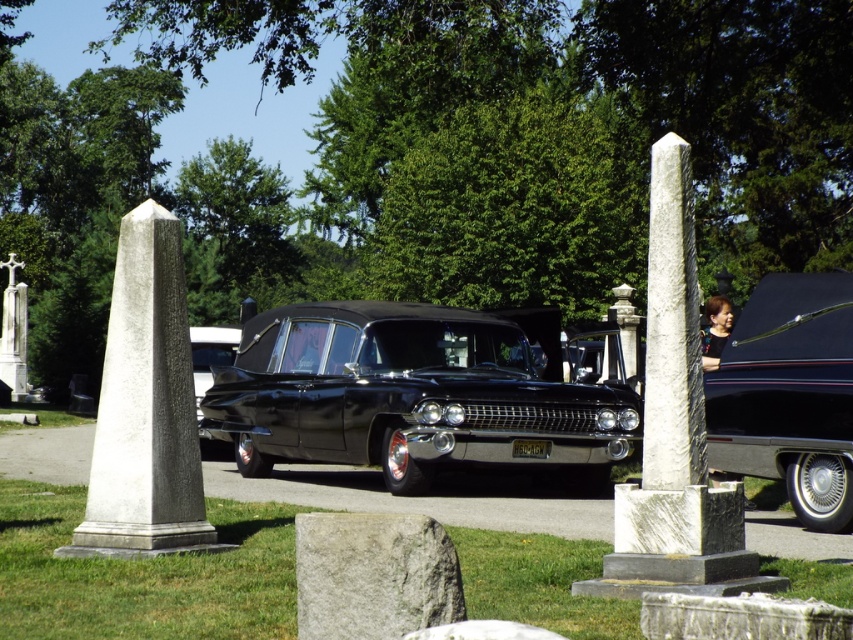
Question: Can you confirm if white marble obelisk at center is bigger than white marble cross at center?

Choices:
 (A) yes
 (B) no

Answer: (B)

Question: Which object is the farthest from the glossy black hearse at center?

Choices:
 (A) white marble cross at center
 (B) white marble obelisk at center

Answer: (A)

Question: Can you confirm if gray marble obelisk at center is bigger than black glossy hearse at center?

Choices:
 (A) no
 (B) yes

Answer: (A)

Question: Which point is farther to the camera?

Choices:
 (A) gray marble obelisk at center
 (B) glossy black hearse at center
 (C) white marble cross at center

Answer: (C)

Question: Which point is farther to the camera?

Choices:
 (A) (674, 193)
 (B) (135, 413)
 (C) (469, 428)
 (D) (849, 502)

Answer: (C)

Question: Is gray marble obelisk at center further to the viewer compared to white marble obelisk at center?

Choices:
 (A) no
 (B) yes

Answer: (B)